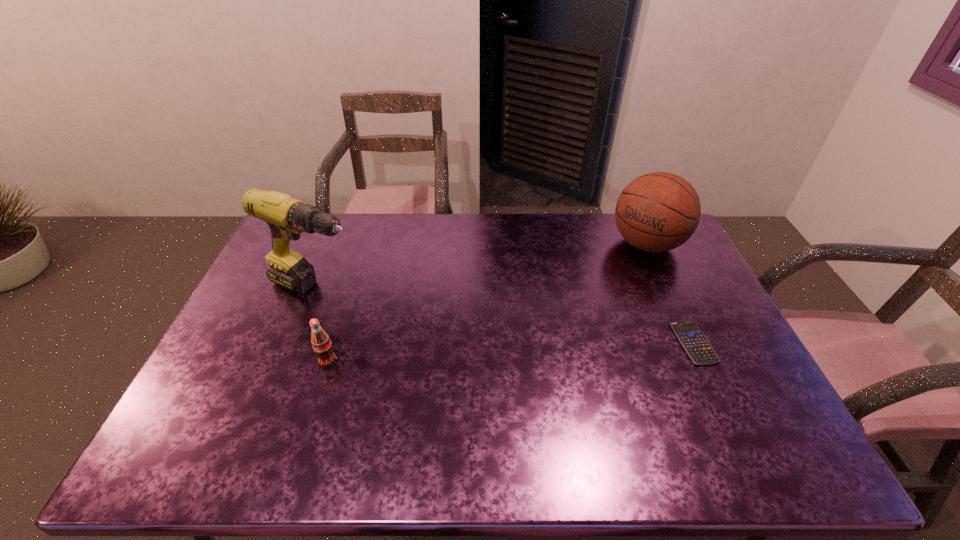
You are a GUI agent. You are given a task and a screenshot of the screen. Output one action in this format:
    pyautogui.click(x=<x>, y=<y>)
    Task: Click on the blank region between the soda and the tallest object
    
    Given the screenshot: What is the action you would take?
    pyautogui.click(x=323, y=325)

Locate an element on the screen. free space between the second tallest object and the shortest object is located at coordinates (670, 293).

Locate an element on the screen. This screenshot has height=540, width=960. free space between the calculator and the soda is located at coordinates (511, 352).

Identify the location of free space between the farthest object and the third nearest object. (482, 266).

Where is `empty space between the soda and the shortest object`? This screenshot has height=540, width=960. empty space between the soda and the shortest object is located at coordinates (511, 352).

This screenshot has width=960, height=540. I want to click on object that is the third nearest to the second shortest object, so click(x=693, y=340).

Point out which object is positioned as the second nearest to the basketball. Please provide its 2D coordinates. Your answer should be formatted as a tuple, i.e. [(x, y)], where the tuple contains the x and y coordinates of a point satisfying the conditions above.

[(287, 217)]